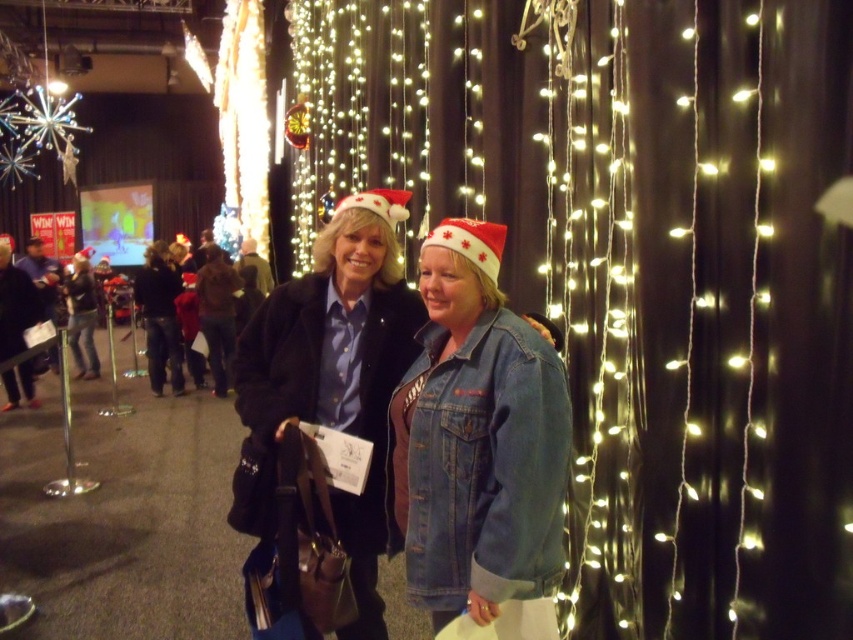
You are organizing a holiday gift exchange and need to determine which denim jacket has more space to display a gift tag. Based on the scene, which denim jacket between the denim jacket at lower right and the denim jacket at center would allow for a larger gift tag?

The denim jacket at center occupies more space than the denim jacket at lower right, so the denim jacket at center would allow for a larger gift tag.

You are a photographer trying to capture both the denim jacket at lower right and the denim jacket at center in a single shot. Given that your camera has a minimum focus distance of 12 inches, will you be able to focus on both jackets simultaneously?

The denim jacket at lower right and denim jacket at center are 15.36 inches apart from each other. Since the distance between them is greater than the camera minimum focus distance of 12 inches, the camera can focus on both jackets simultaneously.

You are a photographer positioned at the back of the room. You want to take a photo of the denim jacket at lower right and the denim jacket at center without any obstruction. Which jacket should you focus on first to ensure it appears in the foreground of the photo?

The denim jacket at lower right is in front of the denim jacket at center, so you should focus on the denim jacket at lower right first to ensure it appears in the foreground of the photo.